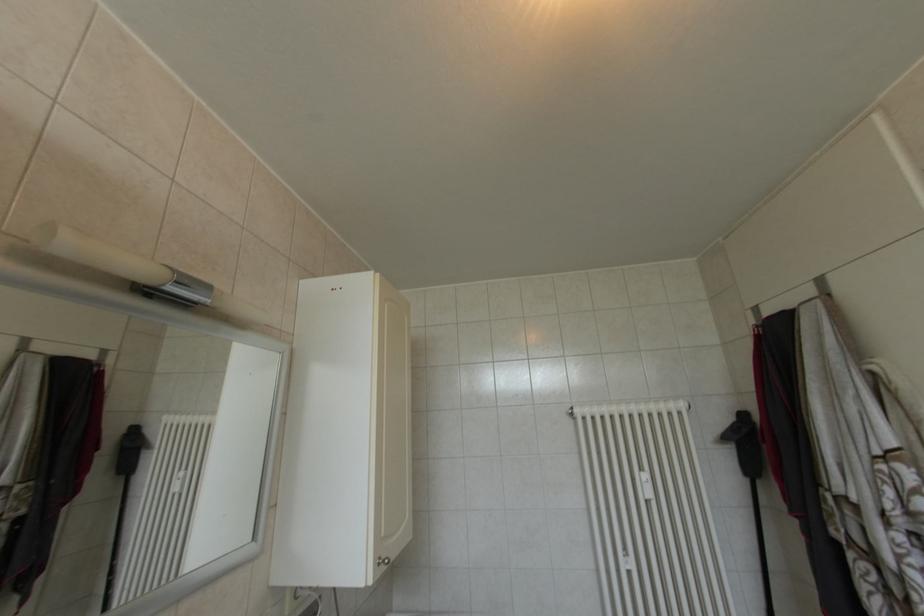
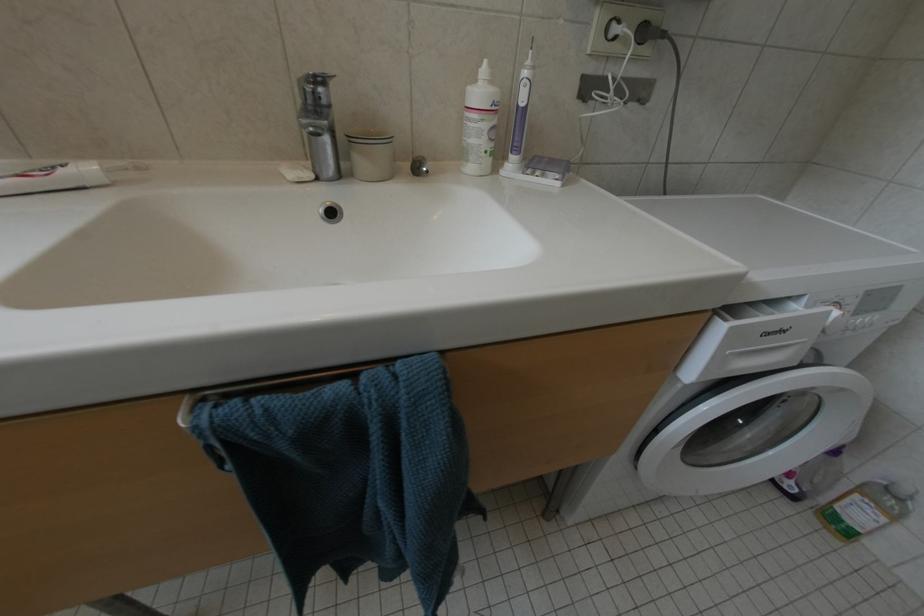
The first image is from the beginning of the video and the second image is from the end. How did the camera likely rotate when shooting the video?

The rotation direction of the camera is left-down.